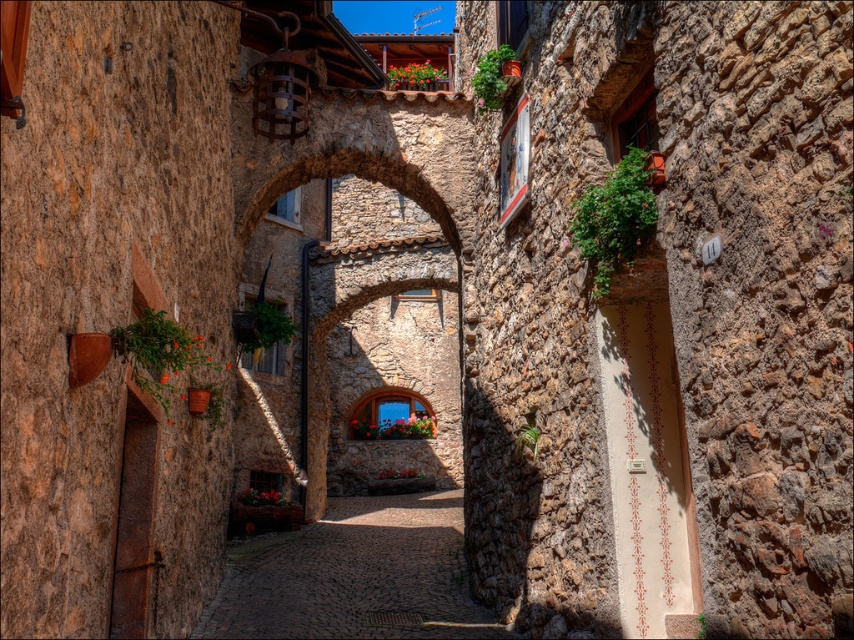
You are a tourist standing at the entrance of the alleyway. You notice the stone archway at center and the cobblestone path at center. Which object appears larger in the image?

The stone archway at center is bigger than the cobblestone path at center, so the stone archway at center appears larger.

You are standing in the middle of the cobblestone alleyway and see two points marked on the ground. One is at point coordinates point (x=317, y=324) and the other is at point coordinates point (x=355, y=634). Which point is closer to you?

Point (x=317, y=324) is closer to you because it is further to the viewer than point (x=355, y=634).

You are a tour guide leading a group through the historic village. You need to explain the layout of the alleyway. Which structure is wider, the stone archway at center or the cobblestone path at center?

The stone archway at center is wider than the cobblestone path at center according to the description provided.